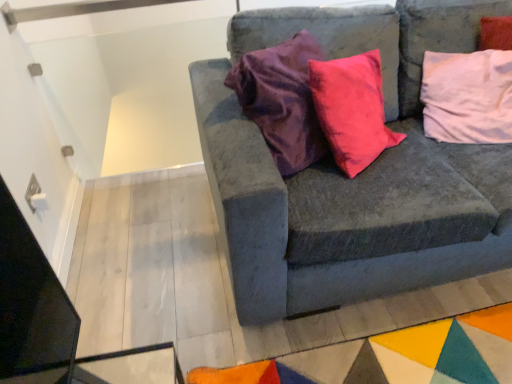
Question: Is velvet gray couch at center behind pink fabric pillow at upper right?

Choices:
 (A) no
 (B) yes

Answer: (A)

Question: Would you say pink fabric pillow at upper right is part of velvet gray couch at center's contents?

Choices:
 (A) yes
 (B) no

Answer: (A)

Question: Is velvet gray couch at center at the right side of pink fabric pillow at upper right?

Choices:
 (A) no
 (B) yes

Answer: (A)

Question: Are velvet gray couch at center and pink fabric pillow at upper right far apart?

Choices:
 (A) yes
 (B) no

Answer: (B)

Question: From the image's perspective, is velvet gray couch at center above pink fabric pillow at upper right?

Choices:
 (A) yes
 (B) no

Answer: (B)

Question: Is velvet gray couch at center at the left side of pink fabric pillow at upper right?

Choices:
 (A) no
 (B) yes

Answer: (B)

Question: From a real-world perspective, is pink fabric pillow at upper right on velvet gray couch at center?

Choices:
 (A) no
 (B) yes

Answer: (B)

Question: From the image's perspective, is pink fabric pillow at upper right on velvet gray couch at center?

Choices:
 (A) no
 (B) yes

Answer: (B)

Question: From the image's perspective, is pink fabric pillow at upper right below velvet gray couch at center?

Choices:
 (A) yes
 (B) no

Answer: (B)

Question: Is pink fabric pillow at upper right at the right side of velvet gray couch at center?

Choices:
 (A) no
 (B) yes

Answer: (B)

Question: Could you tell me if pink fabric pillow at upper right is facing velvet gray couch at center?

Choices:
 (A) yes
 (B) no

Answer: (A)

Question: Does pink fabric pillow at upper right have a smaller size compared to velvet gray couch at center?

Choices:
 (A) no
 (B) yes

Answer: (B)

Question: Which is correct: velvet gray couch at center is inside pink fabric pillow at upper right, or outside of it?

Choices:
 (A) outside
 (B) inside

Answer: (A)